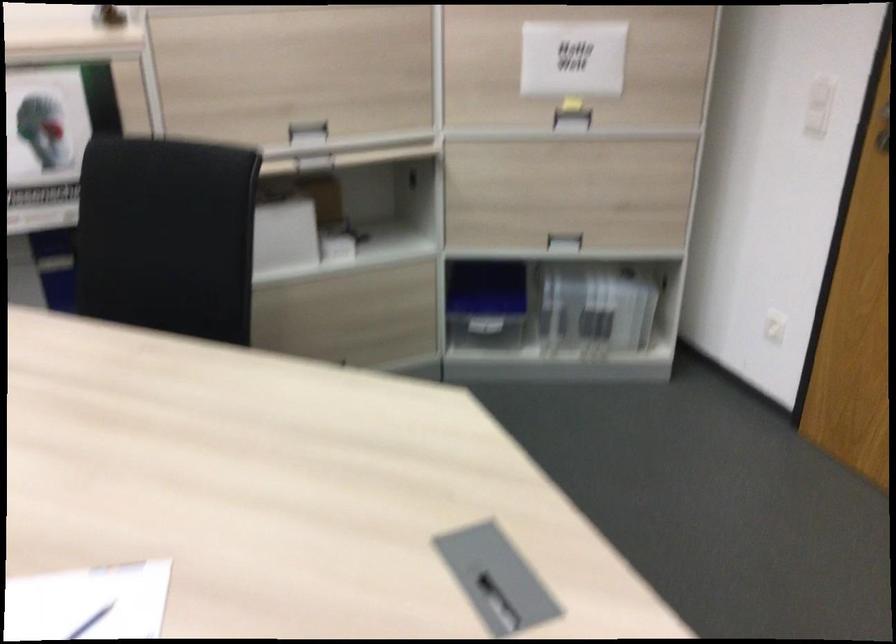
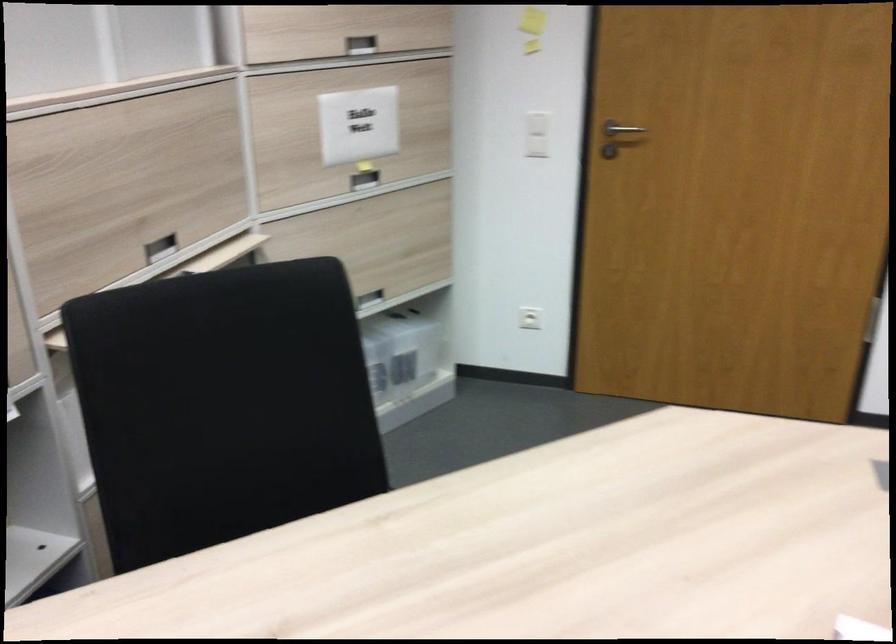
Question: I am providing you with two images of the same scene from different viewpoints. After the viewpoint changes to image2, which objects are now occluded?

Choices:
 (A) white light switch
 (B) metal door handle
 (C) small green knob
 (D) white box

Answer: (D)